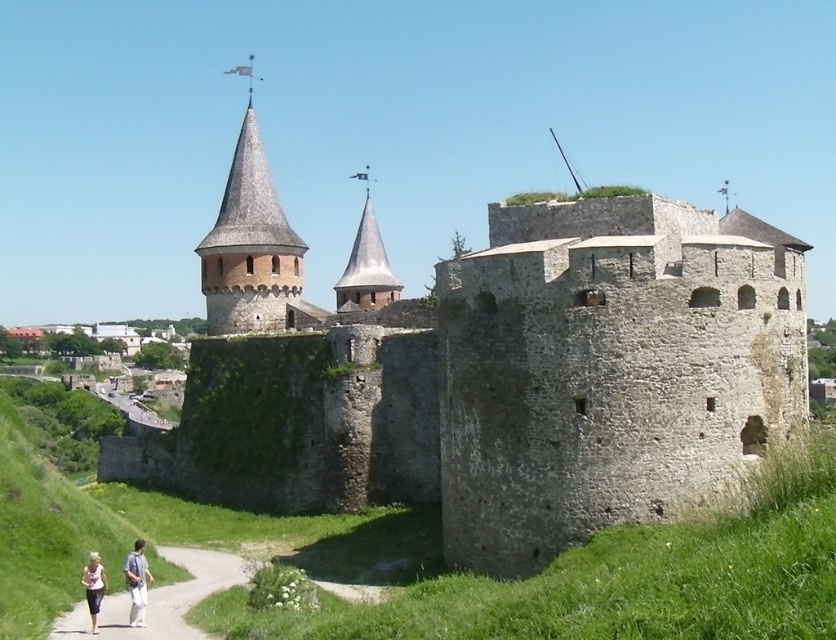
Does smooth stone tower at upper center have a smaller size compared to light pink fabric at lower left?

No.

From the picture: Who is shorter, smooth stone tower at upper center or light pink fabric at lower left?

light pink fabric at lower left is shorter.

Is point (213, 256) closer to viewer compared to point (89, 563)?

No.

Where is `smooth stone tower at upper center`? smooth stone tower at upper center is located at coordinates (248, 243).

How distant is smooth stone tower at upper center from gravel path at lower left?

The distance of smooth stone tower at upper center from gravel path at lower left is 72.52 meters.

Which is below, smooth stone tower at upper center or gravel path at lower left?

gravel path at lower left is lower down.

Identify the location of smooth stone tower at upper center. point(248,243).

Is smooth stone tower at upper center in front of light blue cotton shirt at lower left?

No, smooth stone tower at upper center is behind light blue cotton shirt at lower left.

Can you confirm if smooth stone tower at upper center is positioned above light blue cotton shirt at lower left?

Yes, smooth stone tower at upper center is above light blue cotton shirt at lower left.

Which is in front, point (217, 332) or point (133, 602)?

Positioned in front is point (133, 602).

Locate an element on the screen. smooth stone tower at upper center is located at coordinates (248, 243).